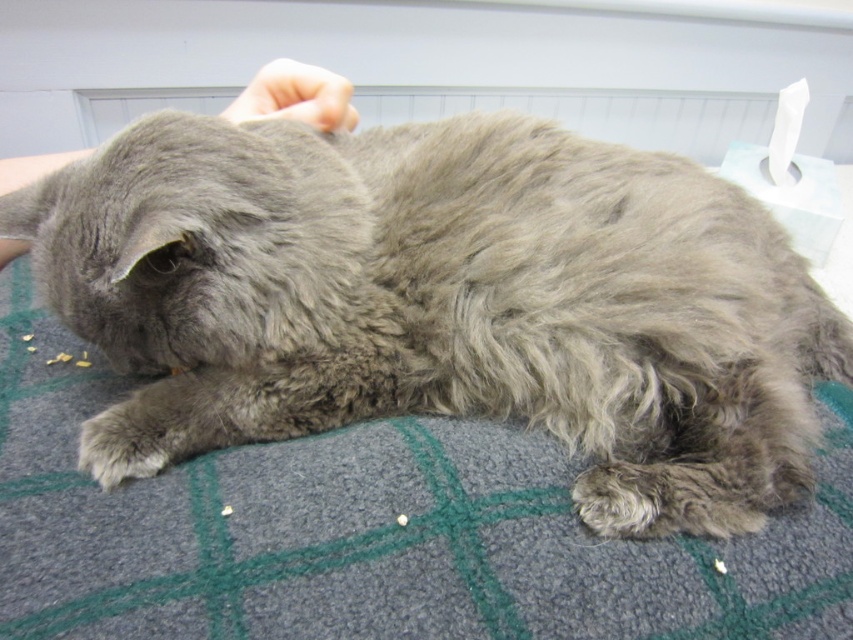
You are a photographer trying to capture the interaction between the gray fluffy cat at center and the smooth skin hand at upper center. Based on their positions, which object is closer to the right edge of the frame?

The gray fluffy cat at center is closer to the right edge of the frame because it is positioned to the right of the smooth skin hand at upper center.

You are a robot trying to determine the order of two points in the image. The points are labeled as point 1 at coordinates point (630,344) and point 2 at coordinates point (248,90). Based on the scene, which point is closer to the viewer?

Point 1 at coordinates point (630,344) is closer to the viewer than point 2 at coordinates point (248,90) because the Objects Description states that point (630,344) is in front of point (248,90).

You are standing in front of the image and want to touch the point at coordinate point (688, 500). If your hand can reach up to 18 inches, will you be able to reach it?

The distance between point (688, 500) and the viewer is 18.91 inches, which is slightly beyond your hand reach of 18 inches. Therefore, you cannot reach it.